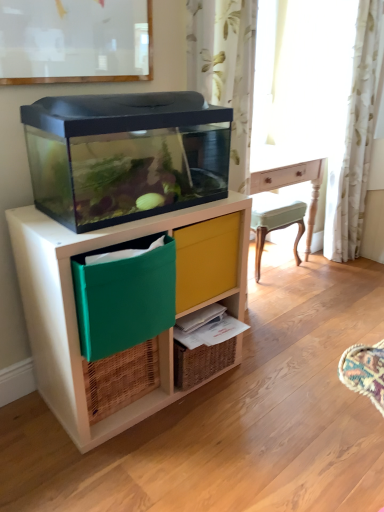
You are a GUI agent. You are given a task and a screenshot of the screen. Output one action in this format:
    pyautogui.click(x=<x>, y=<y>)
    Task: Click on the vacant area to the right of transparent plastic aquarium at left
    The image size is (384, 512).
    Given the screenshot: What is the action you would take?
    pyautogui.click(x=281, y=387)